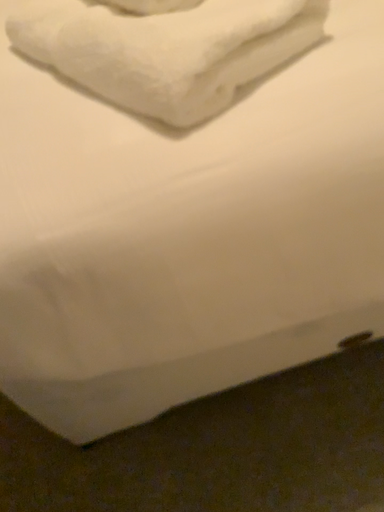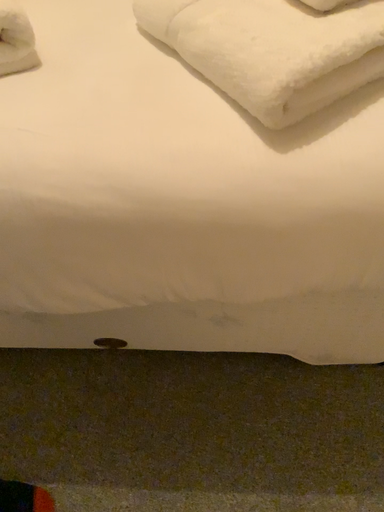
Question: How did the camera likely rotate when shooting the video?

Choices:
 (A) rotated right
 (B) rotated left

Answer: (B)